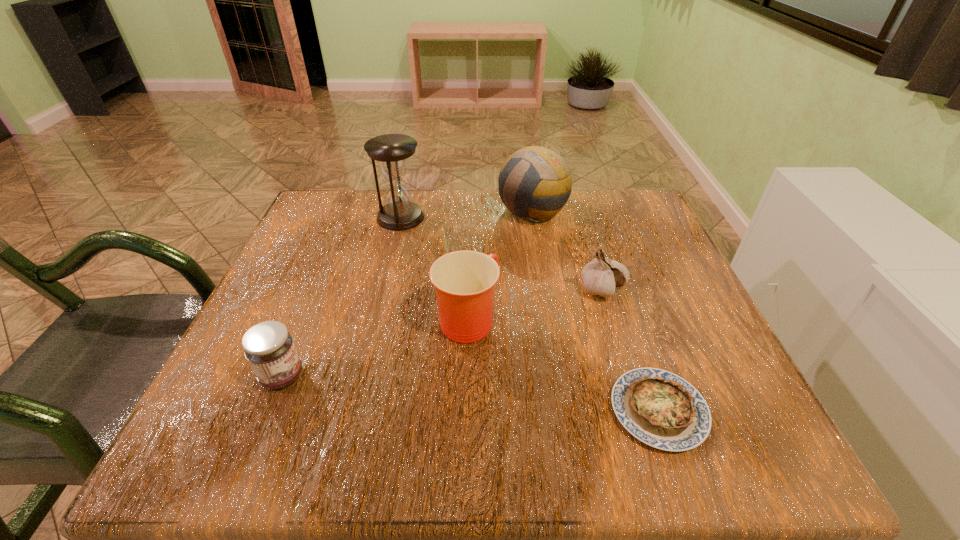
What are the coordinates of `free region at the near edge of the desktop` in the screenshot? It's located at (425, 463).

This screenshot has height=540, width=960. In the image, there is a desktop. Find the location of `free space at the left edge`. free space at the left edge is located at coordinates (289, 266).

The width and height of the screenshot is (960, 540). In the image, there is a desktop. What are the coordinates of `free space at the right edge` in the screenshot? It's located at (644, 288).

Where is `vacant space at the far left corner of the desktop`? vacant space at the far left corner of the desktop is located at coordinates (339, 202).

The height and width of the screenshot is (540, 960). In order to click on free space at the near left corner in this screenshot , I will do `click(240, 441)`.

Find the location of a particular element. Image resolution: width=960 pixels, height=540 pixels. vacant space at the far right corner of the desktop is located at coordinates (642, 213).

Locate an element on the screen. This screenshot has height=540, width=960. blank space at the near right corner is located at coordinates (712, 448).

The width and height of the screenshot is (960, 540). What are the coordinates of `empty location between the hourglass and the volleyball` in the screenshot? It's located at (467, 214).

At what (x,y) coordinates should I click in order to perform the action: click on vacant space in between the volleyball and the garlic. Please return your answer as a coordinate pair (x, y). The width and height of the screenshot is (960, 540). Looking at the image, I should click on (567, 250).

You are a GUI agent. You are given a task and a screenshot of the screen. Output one action in this format:
    pyautogui.click(x=<x>, y=<y>)
    Task: Click on the free space between the jam and the fourth object from right to left
    The width and height of the screenshot is (960, 540).
    Given the screenshot: What is the action you would take?
    pyautogui.click(x=374, y=347)